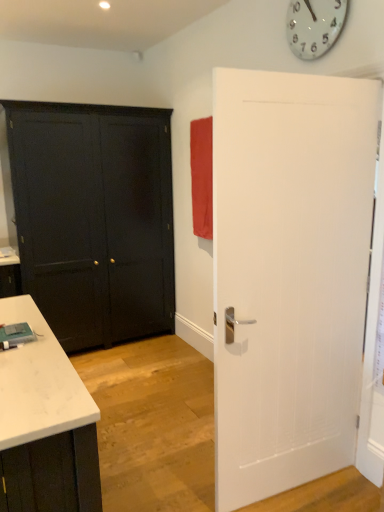
Question: Considering the relative sizes of white glossy clock at upper center and matte black door at left, the first door positioned from the back, in the image provided, is white glossy clock at upper center shorter than matte black door at left, the first door positioned from the back,?

Choices:
 (A) no
 (B) yes

Answer: (B)

Question: Does white glossy clock at upper center have a smaller size compared to matte black door at left, the first door positioned from the back?

Choices:
 (A) no
 (B) yes

Answer: (B)

Question: Considering the relative sizes of white glossy clock at upper center and matte black door at left, the first door positioned from the back, in the image provided, is white glossy clock at upper center taller than matte black door at left, the first door positioned from the back,?

Choices:
 (A) no
 (B) yes

Answer: (A)

Question: Does white glossy clock at upper center turn towards matte black door at left, the first door positioned from the back?

Choices:
 (A) yes
 (B) no

Answer: (B)

Question: Does white glossy clock at upper center touch matte black door at left, acting as the first door starting from the left?

Choices:
 (A) no
 (B) yes

Answer: (A)

Question: From the image's perspective, is white textured door at right, which ranks as the 1th door in front-to-back order, positioned above or below matte red curtain at upper right?

Choices:
 (A) above
 (B) below

Answer: (B)

Question: Relative to matte red curtain at upper right, is white textured door at right, positioned as the 2th door in left-to-right order, in front or behind?

Choices:
 (A) front
 (B) behind

Answer: (A)

Question: Considering the positions of white textured door at right, which is counted as the 1th door, starting from the right, and matte red curtain at upper right in the image, is white textured door at right, which is counted as the 1th door, starting from the right, taller or shorter than matte red curtain at upper right?

Choices:
 (A) tall
 (B) short

Answer: (A)

Question: From a real-world perspective, is white textured door at right, positioned as the 2th door in left-to-right order, positioned above or below matte red curtain at upper right?

Choices:
 (A) above
 (B) below

Answer: (B)

Question: Does point (160, 239) appear closer or farther from the camera than point (306, 88)?

Choices:
 (A) farther
 (B) closer

Answer: (A)

Question: Is matte black door at left, arranged as the second door when viewed from the front, bigger or smaller than white textured door at right, which ranks as the 1th door in front-to-back order?

Choices:
 (A) big
 (B) small

Answer: (A)

Question: Considering the relative positions of matte black door at left, acting as the first door starting from the left, and white textured door at right, the second door positioned from the back, in the image provided, is matte black door at left, acting as the first door starting from the left, to the left or to the right of white textured door at right, the second door positioned from the back,?

Choices:
 (A) left
 (B) right

Answer: (A)

Question: Is matte black door at left, the first door positioned from the back, inside or outside of white textured door at right, which ranks as the 1th door in front-to-back order?

Choices:
 (A) inside
 (B) outside

Answer: (B)

Question: Is matte red curtain at upper right in front of or behind matte black door at left, the 2th door from the right, in the image?

Choices:
 (A) front
 (B) behind

Answer: (B)

Question: From their relative heights in the image, would you say matte red curtain at upper right is taller or shorter than matte black door at left, the first door positioned from the back?

Choices:
 (A) short
 (B) tall

Answer: (A)